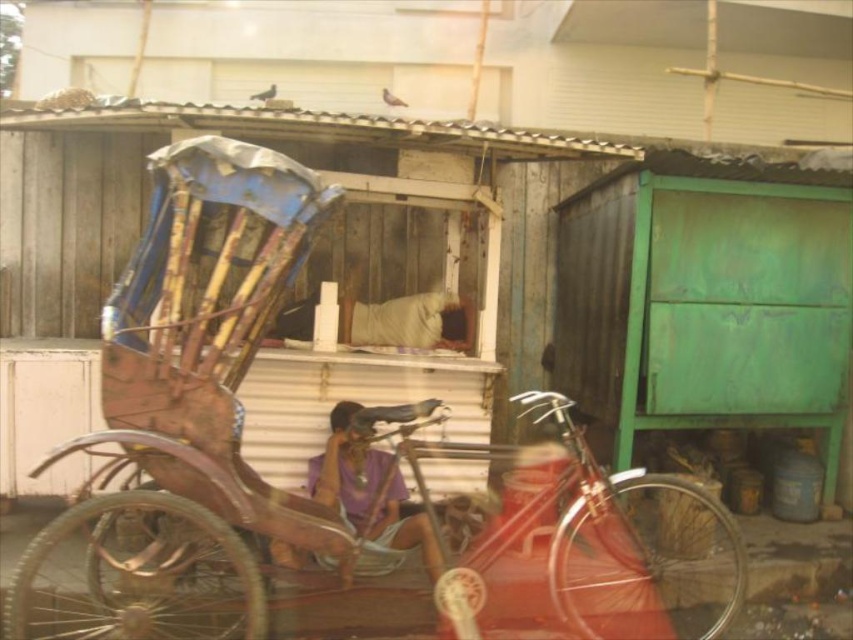
You are a delivery person trying to maneuver a package through the narrow alley between the rusty wood rickshaw at center and the purple fabric at center. Can you estimate if the space between them is wide enough for your delivery cart, which is 1.2 meters wide?

The rusty wood rickshaw at center might be wider than purple fabric at center, so the space between them may not be wide enough for a 1.2 meter wide delivery cart. Check the exact width before proceeding.

You are standing at the point labeled as point (x=328, y=472) in the image. What object are you currently standing on?

The point (x=328, y=472) indicates the rusty wood rickshaw at center, so you are standing on the rusty wood rickshaw at center.